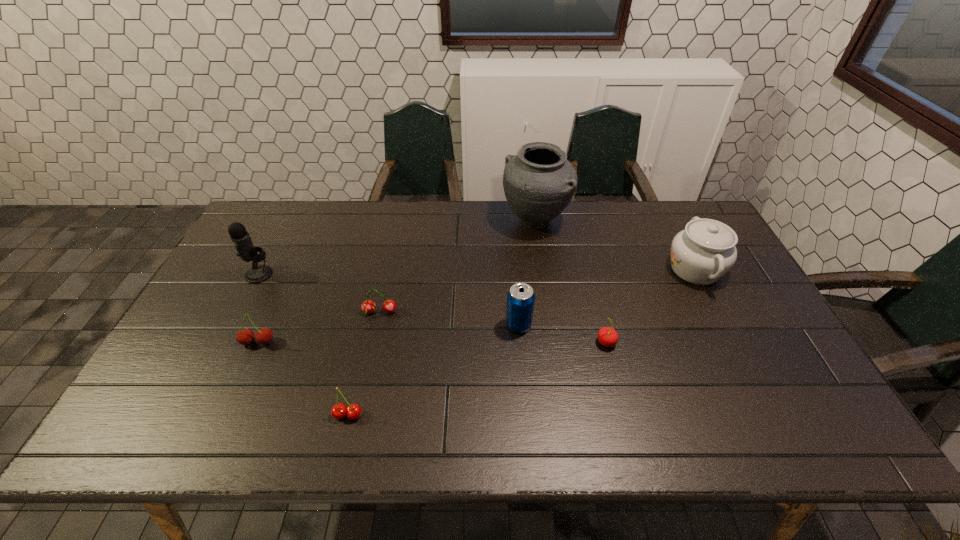
This screenshot has height=540, width=960. What are the coordinates of `object located in the near edge section of the desktop` in the screenshot? It's located at (339, 410).

Identify the location of object located in the left edge section of the desktop. point(240,237).

The width and height of the screenshot is (960, 540). I want to click on object positioned at the right edge, so click(x=702, y=253).

You are a GUI agent. You are given a task and a screenshot of the screen. Output one action in this format:
    pyautogui.click(x=<x>, y=<y>)
    Task: Click on the vacant space at the far edge
    The height and width of the screenshot is (540, 960).
    Given the screenshot: What is the action you would take?
    pyautogui.click(x=400, y=241)

Identify the location of vacant area at the near edge of the desktop. pos(729,422).

The width and height of the screenshot is (960, 540). In order to click on vacant space at the far right corner of the desktop in this screenshot , I will do `click(689, 204)`.

The width and height of the screenshot is (960, 540). Find the location of `vacant region between the fourth shortest object and the farthest cherry`. vacant region between the fourth shortest object and the farthest cherry is located at coordinates (319, 327).

The width and height of the screenshot is (960, 540). I want to click on blank region between the sixth shortest object and the leftmost cherry, so click(476, 306).

Where is `free space between the rightmost object and the seventh object from right to left`? The width and height of the screenshot is (960, 540). free space between the rightmost object and the seventh object from right to left is located at coordinates (476, 306).

Identify the location of free spot between the farthest cherry and the second object from left to right. Image resolution: width=960 pixels, height=540 pixels. (319, 327).